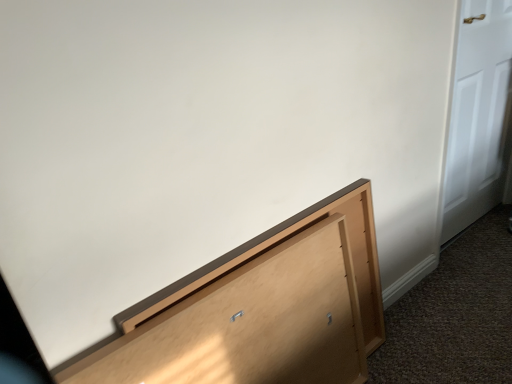
Describe the element at coordinates (478, 114) in the screenshot. I see `white glossy door at right` at that location.

Find the location of a particular element. white glossy door at right is located at coordinates (478, 114).

Consider the image. In order to face light brown wood cabinet at lower right, should I rotate leftwards or rightwards?

A 0.022 degree turn to the left will do.

The width and height of the screenshot is (512, 384). What do you see at coordinates (262, 312) in the screenshot?
I see `light brown wood cabinet at lower right` at bounding box center [262, 312].

What are the coordinates of `light brown wood cabinet at lower right` in the screenshot? It's located at (262, 312).

Find the location of `white glossy door at right`. white glossy door at right is located at coordinates (478, 114).

Which object is positioned more to the left, white glossy door at right or light brown wood cabinet at lower right?

From the viewer's perspective, light brown wood cabinet at lower right appears more on the left side.

Consider the image. Which object is further away from the camera, white glossy door at right or light brown wood cabinet at lower right?

white glossy door at right is further away from the camera.

Is point (464, 181) farther from viewer compared to point (353, 286)?

Yes, it is behind point (353, 286).

From the image's perspective, does white glossy door at right appear lower than light brown wood cabinet at lower right?

No, from the image's perspective, white glossy door at right is not below light brown wood cabinet at lower right.

From a real-world perspective, is white glossy door at right located higher than light brown wood cabinet at lower right?

Indeed, from a real-world perspective, white glossy door at right stands above light brown wood cabinet at lower right.

Which of these two, white glossy door at right or light brown wood cabinet at lower right, is wider?

Wider between the two is white glossy door at right.

Which of these two, white glossy door at right or light brown wood cabinet at lower right, stands taller?

white glossy door at right is taller.

Is white glossy door at right bigger or smaller than light brown wood cabinet at lower right?

Considering their sizes, white glossy door at right takes up more space than light brown wood cabinet at lower right.

Is white glossy door at right spatially inside light brown wood cabinet at lower right, or outside of it?

white glossy door at right exists outside the volume of light brown wood cabinet at lower right.

Is the surface of white glossy door at right in direct contact with light brown wood cabinet at lower right?

white glossy door at right and light brown wood cabinet at lower right are clearly separated.

Is white glossy door at right facing towards light brown wood cabinet at lower right?

No, white glossy door at right does not turn towards light brown wood cabinet at lower right.

How different are the orientations of white glossy door at right and light brown wood cabinet at lower right in degrees?

There is a 2.4-degree angle between the facing directions of white glossy door at right and light brown wood cabinet at lower right.

The width and height of the screenshot is (512, 384). Identify the location of door above the light brown wood cabinet at lower right (from the image's perspective). (478, 114).

Which is more to the left, light brown wood cabinet at lower right or white glossy door at right?

light brown wood cabinet at lower right.

Considering the positions of objects light brown wood cabinet at lower right and white glossy door at right in the image provided, who is behind, light brown wood cabinet at lower right or white glossy door at right?

white glossy door at right is further from the camera.

Is point (167, 373) positioned before point (481, 157)?

That is True.

From the image's perspective, is light brown wood cabinet at lower right below white glossy door at right?

Correct, light brown wood cabinet at lower right appears lower than white glossy door at right in the image.

From a real-world perspective, which object stands above the other?

white glossy door at right is physically above.

Based on the photo, does light brown wood cabinet at lower right have a lesser width compared to white glossy door at right?

Correct, the width of light brown wood cabinet at lower right is less than that of white glossy door at right.

Does light brown wood cabinet at lower right have a lesser height compared to white glossy door at right?

Yes.

Can you confirm if light brown wood cabinet at lower right is smaller than white glossy door at right?

Correct, light brown wood cabinet at lower right occupies less space than white glossy door at right.

Does light brown wood cabinet at lower right contain white glossy door at right?

Actually, white glossy door at right is outside light brown wood cabinet at lower right.

Is light brown wood cabinet at lower right far from white glossy door at right?

No, light brown wood cabinet at lower right is not far away from white glossy door at right.

Is white glossy door at right at the back of light brown wood cabinet at lower right?

No, light brown wood cabinet at lower right's orientation is not away from white glossy door at right.

From the picture: Can you tell me how much light brown wood cabinet at lower right and white glossy door at right differ in facing direction?

There is a 2.4-degree angle between the facing directions of light brown wood cabinet at lower right and white glossy door at right.

How distant is light brown wood cabinet at lower right from white glossy door at right?

A distance of 38.34 inches exists between light brown wood cabinet at lower right and white glossy door at right.

At what (x,y) coordinates should I click in order to perform the action: click on door that appears above the light brown wood cabinet at lower right (from a real-world perspective). Please return your answer as a coordinate pair (x, y). Looking at the image, I should click on click(478, 114).

What are the coordinates of `furniture to the left of white glossy door at right` in the screenshot? It's located at (262, 312).

Identify the location of furniture that is in front of the white glossy door at right. The image size is (512, 384). (262, 312).